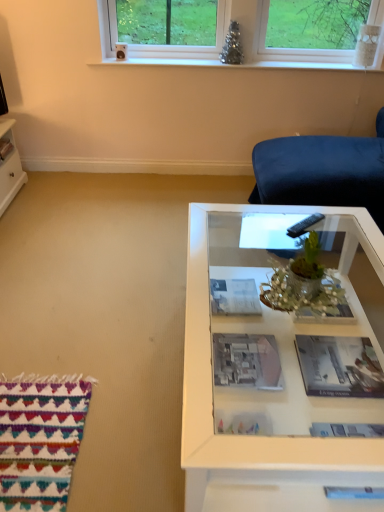
Where is `free point above matte gray book at center, the second book positioned from the top (from a real-world perspective)`? free point above matte gray book at center, the second book positioned from the top (from a real-world perspective) is located at coordinates (241, 359).